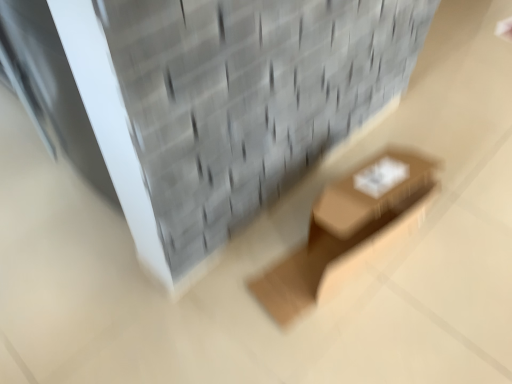
Locate an element on the screen. This screenshot has width=512, height=384. free spot in front of brown cardboard box at center is located at coordinates (360, 334).